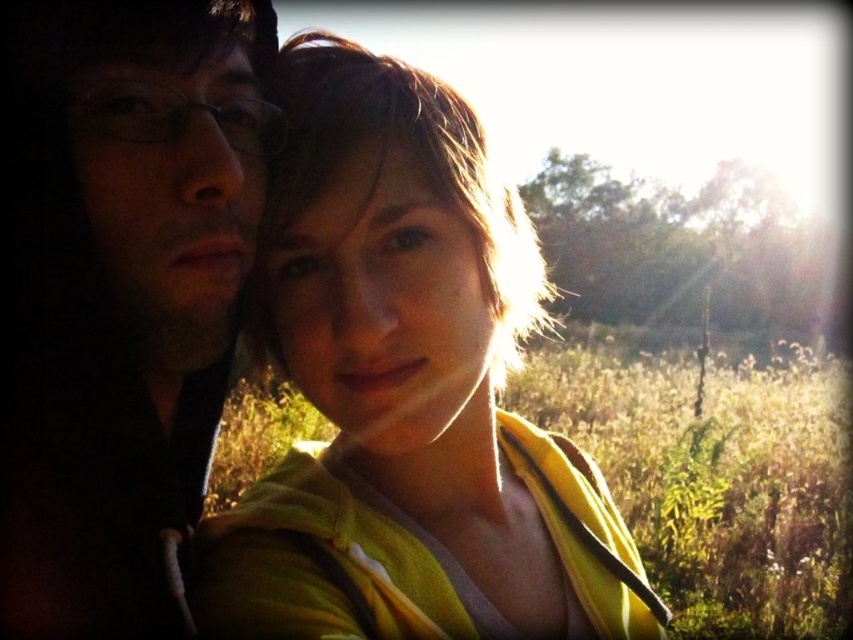
Question: Which point is closer to the camera?

Choices:
 (A) yellow fabric at center
 (B) matte black hoodie at left

Answer: (B)

Question: Does yellow fabric at center have a lesser width compared to matte black hoodie at left?

Choices:
 (A) yes
 (B) no

Answer: (B)

Question: Considering the relative positions of yellow fabric at center and matte black hoodie at left in the image provided, where is yellow fabric at center located with respect to matte black hoodie at left?

Choices:
 (A) above
 (B) below

Answer: (B)

Question: Which point is farther from the camera taking this photo?

Choices:
 (A) (579, 509)
 (B) (18, 449)

Answer: (A)

Question: From the image, what is the correct spatial relationship of yellow fabric at center in relation to matte black hoodie at left?

Choices:
 (A) left
 (B) right

Answer: (B)

Question: Among these points, which one is farthest from the camera?

Choices:
 (A) (421, 205)
 (B) (177, 234)

Answer: (A)